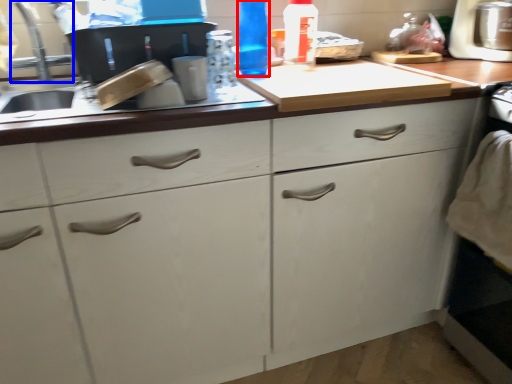
Question: Which point is closer to the camera, bottle (highlighted by a red box) or faucet (highlighted by a blue box)?

Choices:
 (A) bottle
 (B) faucet

Answer: (B)